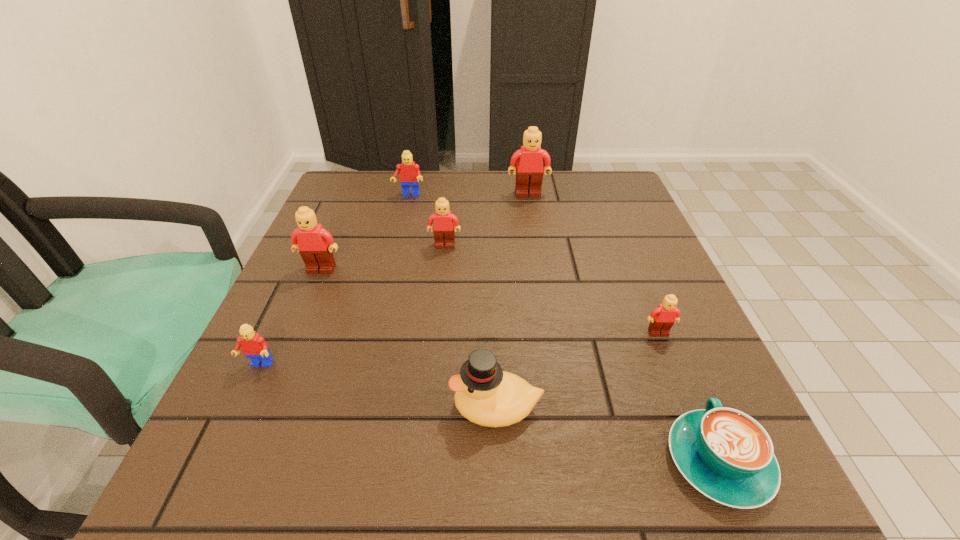
Identify the location of unoccupied position between the fifth Lego from left to right and the nearest Lego. The image size is (960, 540). (394, 280).

The image size is (960, 540). In order to click on free space between the smallest brown Lego and the left red Lego in this screenshot , I will do `click(459, 349)`.

The width and height of the screenshot is (960, 540). Identify the location of free area in between the smaller red Lego and the third nearest Lego. (290, 318).

You are a GUI agent. You are given a task and a screenshot of the screen. Output one action in this format:
    pyautogui.click(x=<x>, y=<y>)
    Task: Click on the vacant space in between the third nearest brown Lego and the third object from left to right
    
    Given the screenshot: What is the action you would take?
    pyautogui.click(x=427, y=220)

Choose which object is the sixth nearest neighbor to the yellow duck. Please provide its 2D coordinates. Your answer should be formatted as a tuple, i.e. [(x, y)], where the tuple contains the x and y coordinates of a point satisfying the conditions above.

[(529, 171)]

The height and width of the screenshot is (540, 960). I want to click on object that can be found as the fourth closest to the third Lego from left to right, so click(253, 345).

Find the location of a particular element. Lego that can be found as the fifth closest to the yellow duck is located at coordinates (529, 171).

This screenshot has height=540, width=960. I want to click on the closest Lego to the yellow duck, so click(x=663, y=317).

Image resolution: width=960 pixels, height=540 pixels. Identify the location of brown Lego that is the third closest one to the left red Lego. (663, 317).

Identify which brown Lego is the closest to the third farthest Lego. Please provide its 2D coordinates. Your answer should be formatted as a tuple, i.e. [(x, y)], where the tuple contains the x and y coordinates of a point satisfying the conditions above.

[(314, 243)]